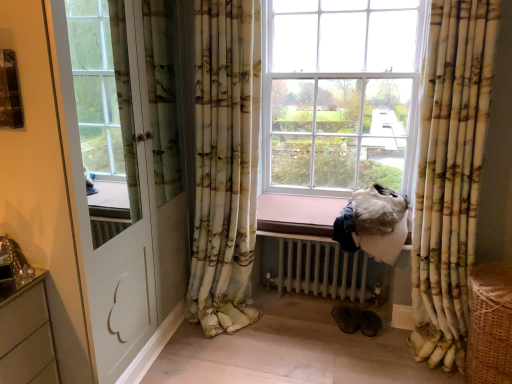
Image resolution: width=512 pixels, height=384 pixels. In order to click on free space in front of white painted metal radiator at lower center in this screenshot , I will do `click(326, 347)`.